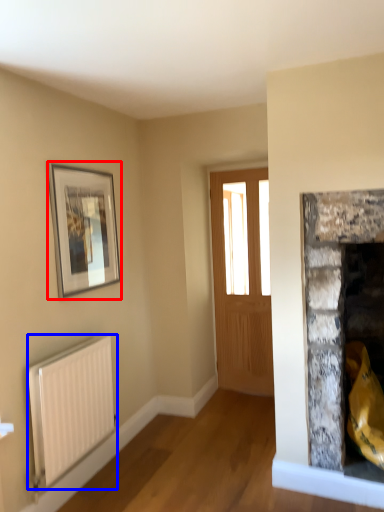
Question: Which object is closer to the camera taking this photo, picture frame (highlighted by a red box) or radiator (highlighted by a blue box)?

Choices:
 (A) picture frame
 (B) radiator

Answer: (B)